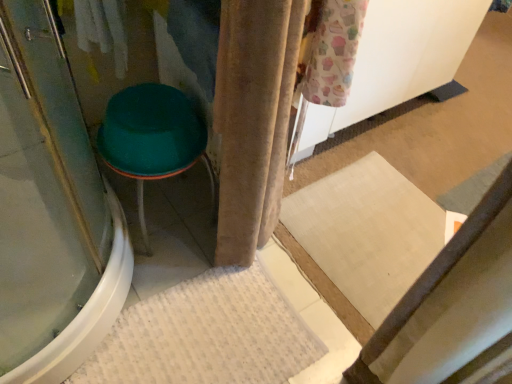
Question: Does transparent glass screen door at left appear on the right side of green plastic stool at left?

Choices:
 (A) no
 (B) yes

Answer: (A)

Question: Is transparent glass screen door at left wider than green plastic stool at left?

Choices:
 (A) yes
 (B) no

Answer: (A)

Question: From the image's perspective, is transparent glass screen door at left on green plastic stool at left?

Choices:
 (A) yes
 (B) no

Answer: (A)

Question: Is transparent glass screen door at left closer to the viewer compared to green plastic stool at left?

Choices:
 (A) no
 (B) yes

Answer: (B)

Question: From a real-world perspective, is transparent glass screen door at left positioned over green plastic stool at left based on gravity?

Choices:
 (A) yes
 (B) no

Answer: (A)

Question: Is transparent glass screen door at left touching green plastic stool at left?

Choices:
 (A) yes
 (B) no

Answer: (B)

Question: Is transparent glass screen door at left thinner than white textured bath mat at lower center?

Choices:
 (A) yes
 (B) no

Answer: (B)

Question: Is transparent glass screen door at left to the left of white textured bath mat at lower center from the viewer's perspective?

Choices:
 (A) no
 (B) yes

Answer: (B)

Question: From a real-world perspective, does transparent glass screen door at left stand above white textured bath mat at lower center?

Choices:
 (A) no
 (B) yes

Answer: (B)

Question: Is there a large distance between transparent glass screen door at left and white textured bath mat at lower center?

Choices:
 (A) no
 (B) yes

Answer: (A)

Question: Does transparent glass screen door at left have a smaller size compared to white textured bath mat at lower center?

Choices:
 (A) yes
 (B) no

Answer: (B)

Question: Considering the relative sizes of transparent glass screen door at left and white textured bath mat at lower center in the image provided, is transparent glass screen door at left shorter than white textured bath mat at lower center?

Choices:
 (A) yes
 (B) no

Answer: (B)

Question: Considering the relative sizes of white textured bath mat at lower center and transparent glass screen door at left in the image provided, is white textured bath mat at lower center taller than transparent glass screen door at left?

Choices:
 (A) yes
 (B) no

Answer: (B)